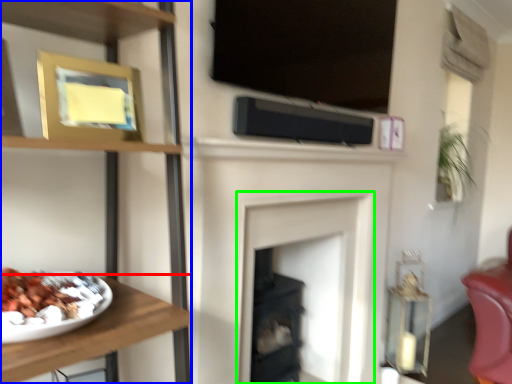
Question: Which is farther away from furniture (highlighted by a red box)? shelf (highlighted by a blue box) or fireplace (highlighted by a green box)?

Choices:
 (A) shelf
 (B) fireplace

Answer: (B)